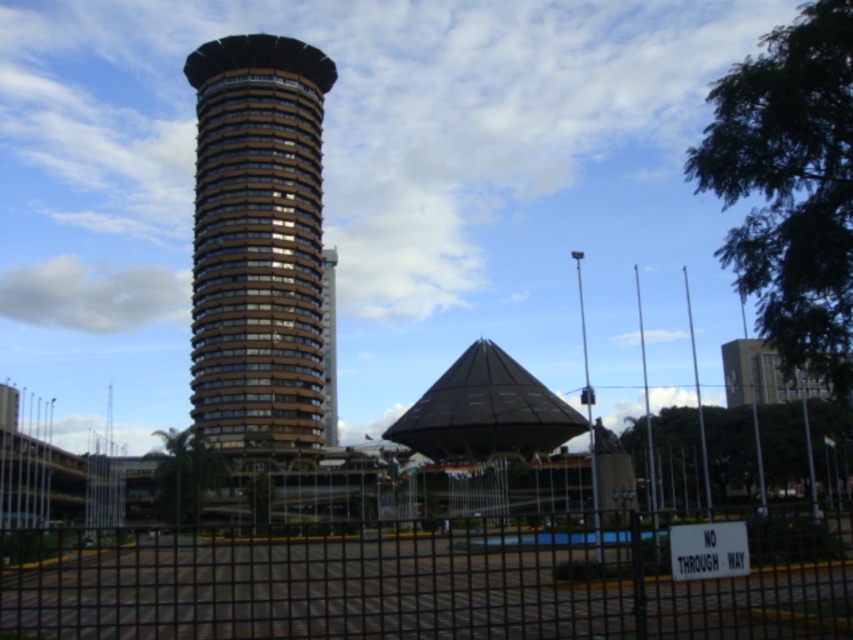
Question: Does black metal fence at lower center appear on the left side of brown glass tower at center?

Choices:
 (A) yes
 (B) no

Answer: (B)

Question: Does black metal fence at lower center have a smaller size compared to brown glass tower at center?

Choices:
 (A) yes
 (B) no

Answer: (B)

Question: Is black metal fence at lower center wider than brown glass tower at center?

Choices:
 (A) yes
 (B) no

Answer: (A)

Question: Which of the following is the closest to the observer?

Choices:
 (A) (538, 556)
 (B) (207, 301)

Answer: (A)

Question: Which point is closer to the camera?

Choices:
 (A) (134, 577)
 (B) (305, 209)

Answer: (A)

Question: Among these points, which one is farthest from the camera?

Choices:
 (A) (297, 355)
 (B) (120, 593)

Answer: (A)